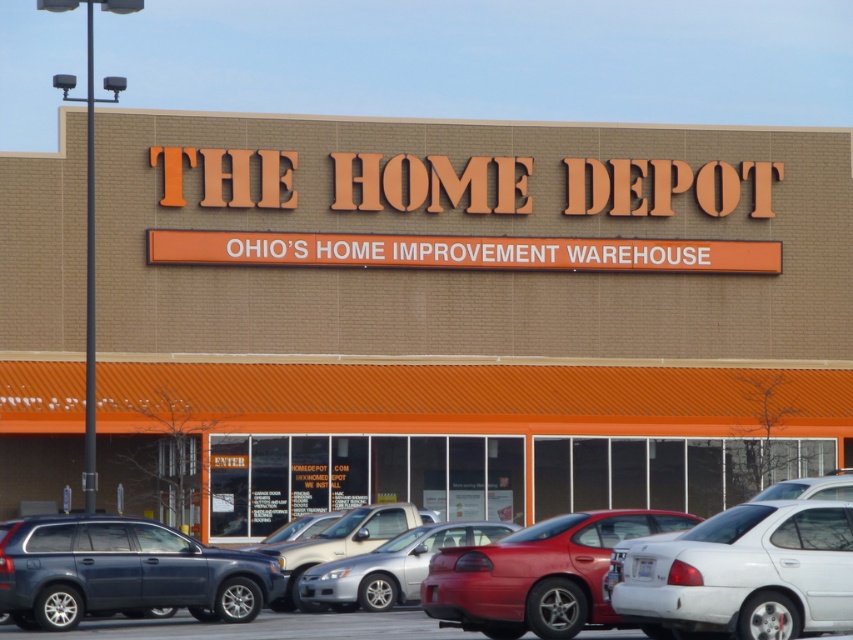
From the picture: You are a delivery driver who needs to park your 2.5 meter wide truck in the parking lot of Ohio Home Depot. You see a metallic silver sedan at center and a silver metallic truck at center. Which vehicle has a wider body? Based on that, can you estimate if your truck can fit into the parking spot next to the narrower vehicle?

The metallic silver sedan at center is wider than the silver metallic truck at center. Since your truck is 2.5 meters wide, and the silver metallic truck at center is narrower, it is likely that your truck can fit into the parking spot next to it, provided there is enough space between them.

You are a customer arriving at the Home Depot store and see two cars in the parking lot. The shiny red car at center and the metallic silver sedan at center. Which car is parked in front of the other?

The shiny red car at center is positioned over metallic silver sedan at center, so the shiny red car is parked in front of the metallic silver sedan.

You are standing at the entrance of Ohio Home Depot and want to walk to the point labeled point (561, 604). However, there is an obstacle at point (756, 572). Can you walk directly to your destination without going around the obstacle?

Point (756, 572) is in front of point (561, 604), so you cannot walk directly to point (561, 604) without going around the obstacle at point (756, 572).